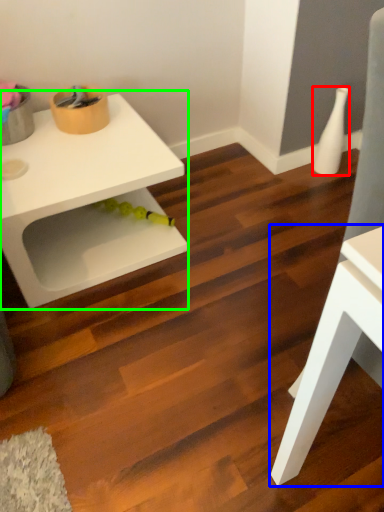
Question: Which is farther away from vase (highlighted by a red box)? table (highlighted by a blue box) or table (highlighted by a green box)?

Choices:
 (A) table
 (B) table

Answer: (A)